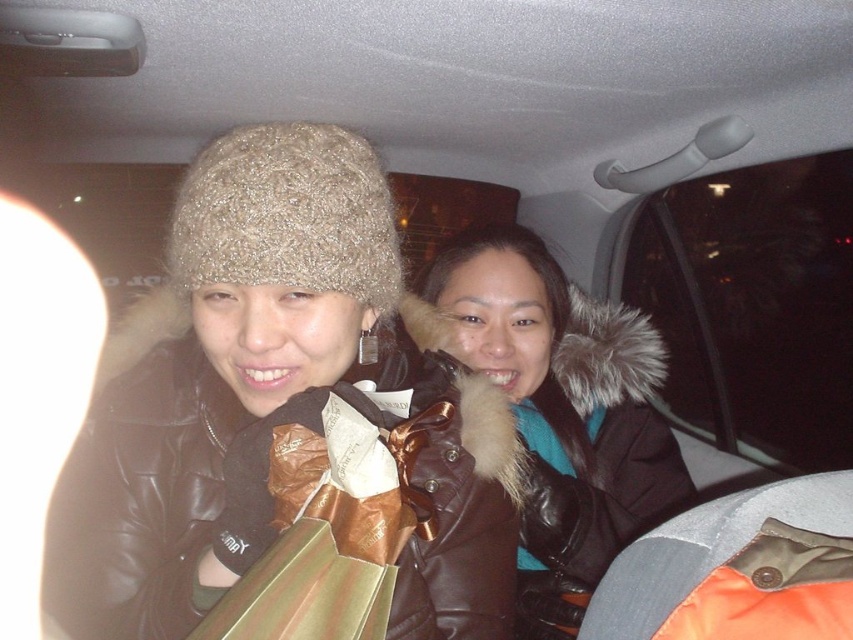
Question: Is brown leather jacket at center to the right of orange fabric at lower right from the viewer's perspective?

Choices:
 (A) no
 (B) yes

Answer: (B)

Question: Is knitted woolen hat at upper left to the right of brown leather jacket at center from the viewer's perspective?

Choices:
 (A) no
 (B) yes

Answer: (A)

Question: Which point appears farthest from the camera in this image?

Choices:
 (A) (466, 611)
 (B) (566, 593)

Answer: (B)

Question: Among these points, which one is nearest to the camera?

Choices:
 (A) (167, 308)
 (B) (285, 244)

Answer: (B)

Question: Among these points, which one is nearest to the camera?

Choices:
 (A) (103, 356)
 (B) (515, 392)

Answer: (A)

Question: Can you confirm if brown leather jacket at center is bigger than knitted beige hat at upper left?

Choices:
 (A) yes
 (B) no

Answer: (A)